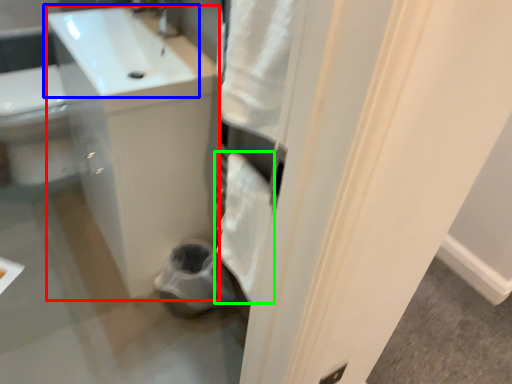
Question: Considering the real-world distances, which object is farthest from counter top (highlighted by a red box)? sink (highlighted by a blue box) or bath towel (highlighted by a green box)?

Choices:
 (A) sink
 (B) bath towel

Answer: (B)